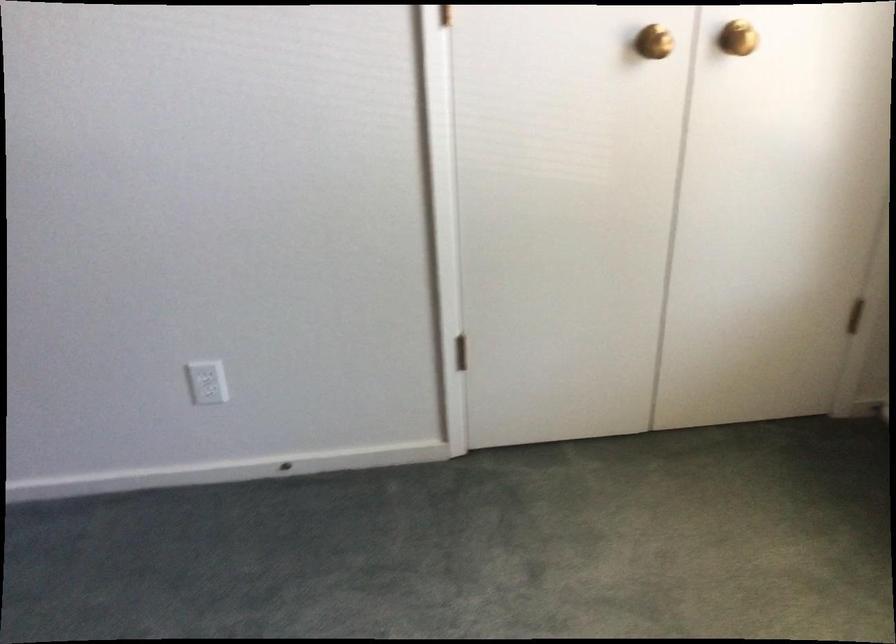
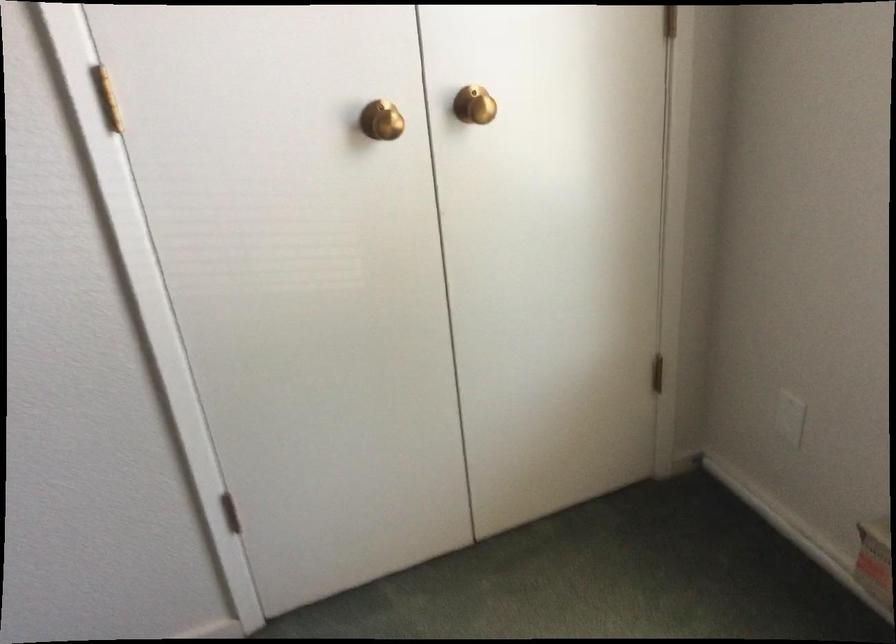
Question: Based on the continuous images, in which direction is the camera rotating? Reply with the corresponding letter.

Choices:
 (A) Left
 (B) Right
 (C) Up
 (D) Down

Answer: (B)